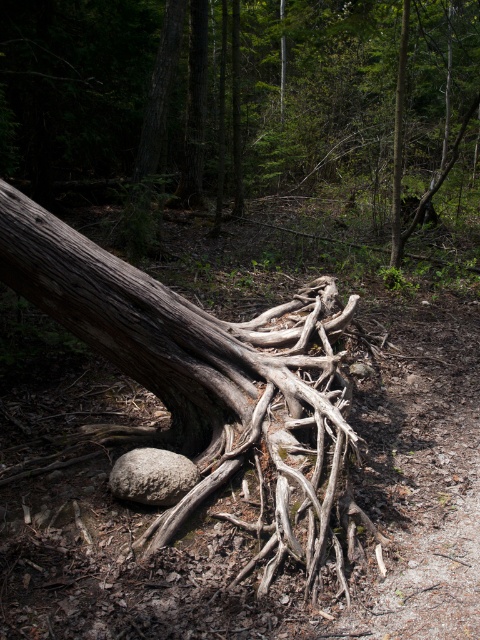
You are standing at the edge of the forest and see the point marked as point (208, 380). What is the color and material of the object located at this point?

The grayish brown wood at center is represented by point (208, 380).